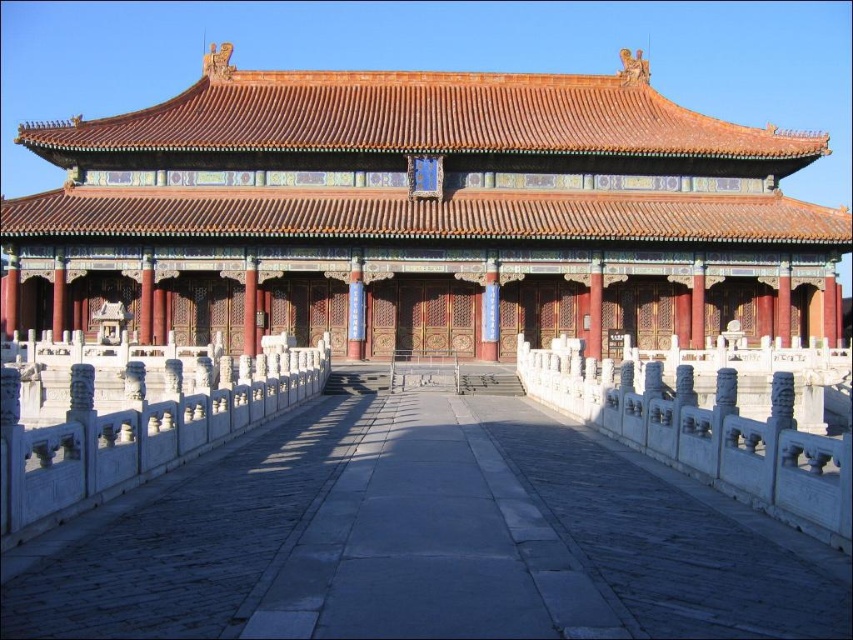
You are an architect examining the building from the front. You need to determine which object is higher between the matte gold roof at center and the white marble railing at left. Based on the scene, which one is taller?

The matte gold roof at center is taller than the white marble railing at left.